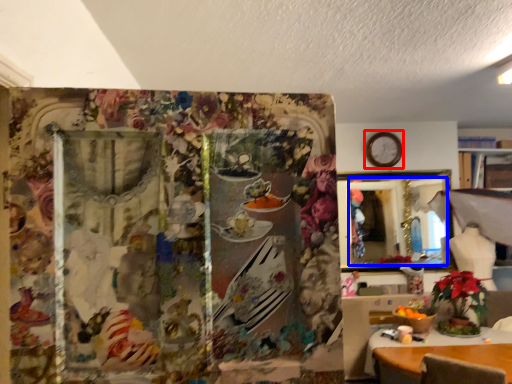
Question: Which object is closer to the camera taking this photo, clock (highlighted by a red box) or mirror (highlighted by a blue box)?

Choices:
 (A) clock
 (B) mirror

Answer: (B)